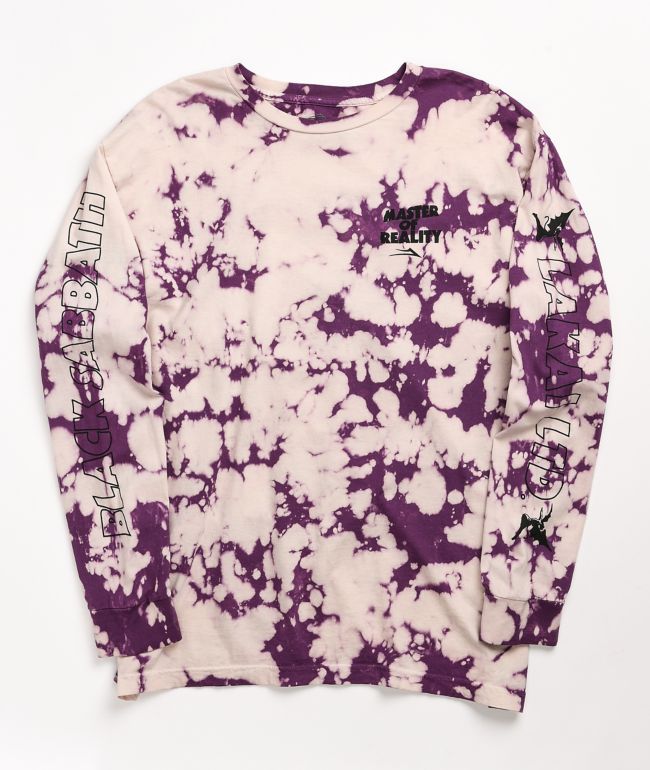
The image size is (650, 770). I want to click on chest, so click(344, 228).